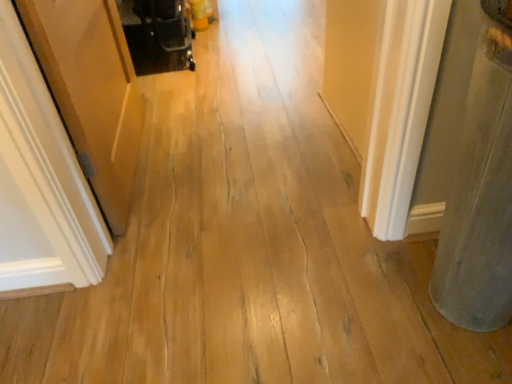
Question: From a real-world perspective, is black plastic baby carriage at upper left located higher than wooden door at left?

Choices:
 (A) yes
 (B) no

Answer: (B)

Question: Is the surface of black plastic baby carriage at upper left in direct contact with wooden door at left?

Choices:
 (A) yes
 (B) no

Answer: (B)

Question: Is black plastic baby carriage at upper left at the left side of wooden door at left?

Choices:
 (A) yes
 (B) no

Answer: (B)

Question: Is black plastic baby carriage at upper left behind wooden door at left?

Choices:
 (A) no
 (B) yes

Answer: (B)

Question: Is black plastic baby carriage at upper left to the right of wooden door at left from the viewer's perspective?

Choices:
 (A) yes
 (B) no

Answer: (A)

Question: From a real-world perspective, is black plastic baby carriage at upper left located beneath wooden door at left?

Choices:
 (A) yes
 (B) no

Answer: (A)

Question: Is gray felt pillow at right not inside black plastic baby carriage at upper left?

Choices:
 (A) no
 (B) yes

Answer: (B)

Question: From a real-world perspective, does gray felt pillow at right stand above black plastic baby carriage at upper left?

Choices:
 (A) no
 (B) yes

Answer: (B)

Question: Does gray felt pillow at right have a lesser width compared to black plastic baby carriage at upper left?

Choices:
 (A) no
 (B) yes

Answer: (A)

Question: From a real-world perspective, is gray felt pillow at right located beneath black plastic baby carriage at upper left?

Choices:
 (A) yes
 (B) no

Answer: (B)

Question: Is gray felt pillow at right beside black plastic baby carriage at upper left?

Choices:
 (A) yes
 (B) no

Answer: (B)

Question: Considering the relative sizes of gray felt pillow at right and black plastic baby carriage at upper left in the image provided, is gray felt pillow at right bigger than black plastic baby carriage at upper left?

Choices:
 (A) no
 (B) yes

Answer: (B)

Question: Considering the relative sizes of gray felt pillow at right and wooden door at left in the image provided, is gray felt pillow at right bigger than wooden door at left?

Choices:
 (A) no
 (B) yes

Answer: (B)